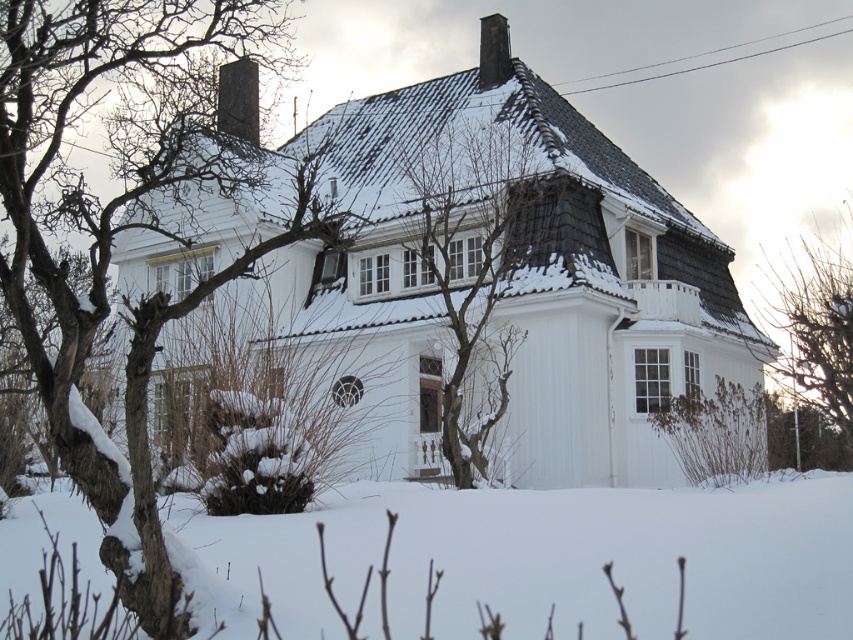
You are standing in front of the house and notice a point marked at coordinates (123, 227). Based on the scene description, what object or feature does this point most likely represent?

The point at (123, 227) corresponds to snow covered branches at left.

Consider the image. You are standing in front of the house and want to know if the white powdery snow at lower center is taller than the bare branches at right. Based on the scene, what can you conclude?

The white powdery snow at lower center has a lesser height compared to the bare branches at right, so the snow is shorter than the branches.

You are standing in front of the house and want to walk to the area with the bare branches at center. Will you step on the white powdery snow at lower center first?

Yes, the white powdery snow at lower center is closer to the viewer than the bare branches at center, so you will step on the white powdery snow at lower center first before reaching the bare branches at center.